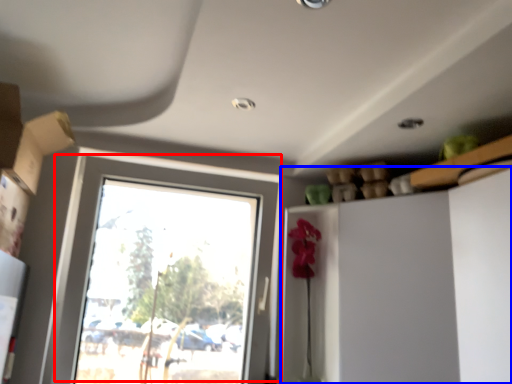
Question: Which object is further to the camera taking this photo, window (highlighted by a red box) or dresser (highlighted by a blue box)?

Choices:
 (A) window
 (B) dresser

Answer: (A)